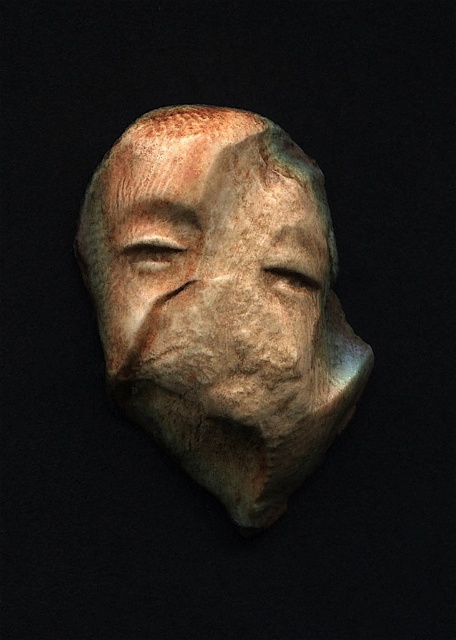
Question: Is matte stone mask at center positioned behind matte stone face at center?

Choices:
 (A) yes
 (B) no

Answer: (A)

Question: Can you confirm if matte stone mask at center is thinner than matte stone face at center?

Choices:
 (A) no
 (B) yes

Answer: (A)

Question: Does matte stone mask at center have a lesser width compared to matte stone face at center?

Choices:
 (A) no
 (B) yes

Answer: (A)